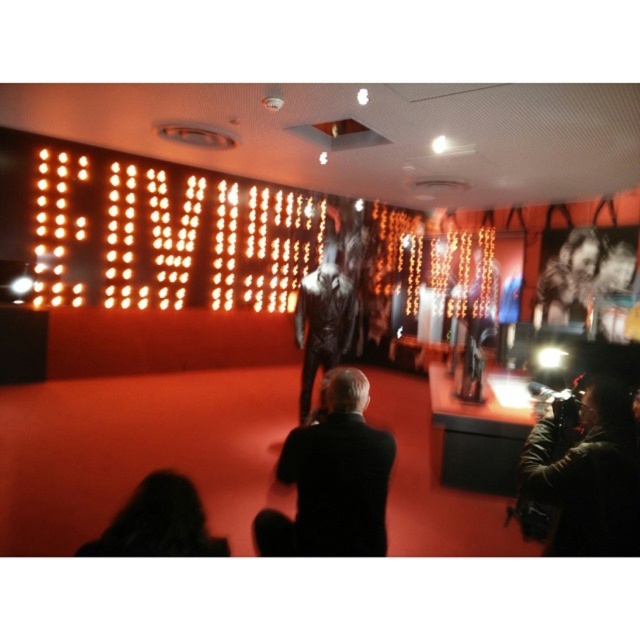
Question: Which of these objects is positioned farthest from the black suit at center?

Choices:
 (A) shiny metallic suit at center
 (B) dark brown leather jacket at lower right
 (C) shiny black hair at upper right
 (D) dark hair at lower left

Answer: (C)

Question: Is the position of dark brown leather jacket at lower right more distant than that of shiny metallic suit at center?

Choices:
 (A) no
 (B) yes

Answer: (A)

Question: Can you confirm if dark hair at lower left is thinner than shiny metallic suit at center?

Choices:
 (A) yes
 (B) no

Answer: (A)

Question: Among these objects, which one is farthest from the camera?

Choices:
 (A) dark hair at lower left
 (B) dark brown leather jacket at lower right
 (C) shiny metallic suit at center

Answer: (C)

Question: Among these objects, which one is farthest from the camera?

Choices:
 (A) shiny metallic suit at center
 (B) black suit at center
 (C) dark hair at lower left

Answer: (A)

Question: Is dark brown leather jacket at lower right thinner than shiny metallic suit at center?

Choices:
 (A) yes
 (B) no

Answer: (A)